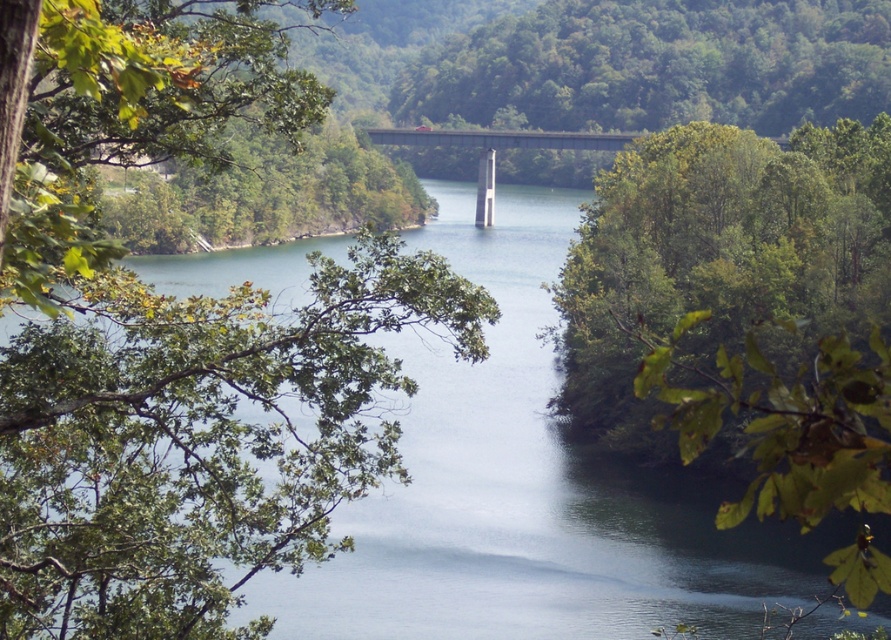
Looking at this image, you are an architect designing a new park. You want to place a small bench between the green leafy tree at left and the concrete bridge at center. Which object will the bench be closer to if it is placed exactly halfway between them?

The bench will be closer to the green leafy tree at left because the distance between the two objects is determined by their widths. Since the green leafy tree at left is thinner than the concrete bridge at center, placing the bench halfway would mean it is closer to the narrower object.

You are standing at the center of the bridge and want to locate the green leafy tree at left. In which direction should you look to see it?

The green leafy tree at left is located at point (174, 340), so you should look to your left since it is positioned to the left side of the scene.

You are standing at the edge of the scene and want to cross the water. The green leafy tree at left and the green smooth water at center are visible. Which object is closer to you in size compared to the other?

The green leafy tree at left is smaller than the green smooth water at center, so the green leafy tree at left is closer to you in size compared to the other object.